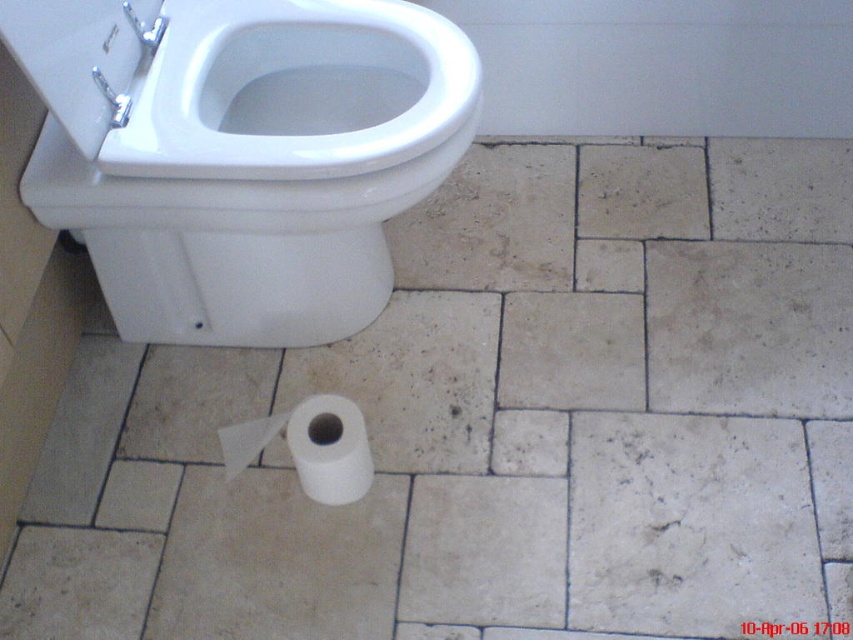
Which is more to the right, white glossy toilet bowl at upper left or white matte toilet paper at lower center?

From the viewer's perspective, white matte toilet paper at lower center appears more on the right side.

How far apart are white glossy toilet bowl at upper left and white matte toilet paper at lower center?

white glossy toilet bowl at upper left and white matte toilet paper at lower center are 14.46 inches apart from each other.

Does point (283, 342) come closer to viewer compared to point (277, 413)?

That is False.

Identify the location of white glossy toilet bowl at upper left. This screenshot has height=640, width=853. (260, 164).